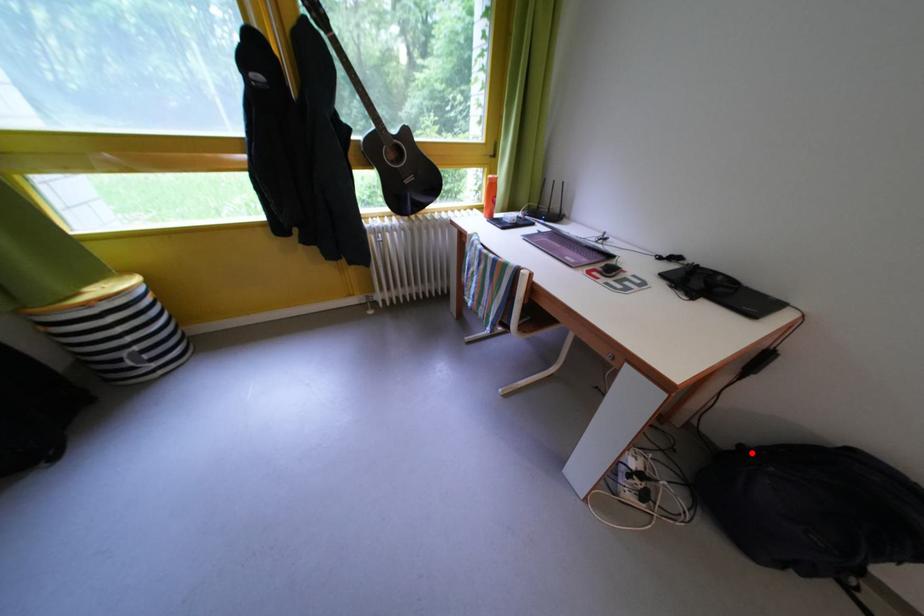
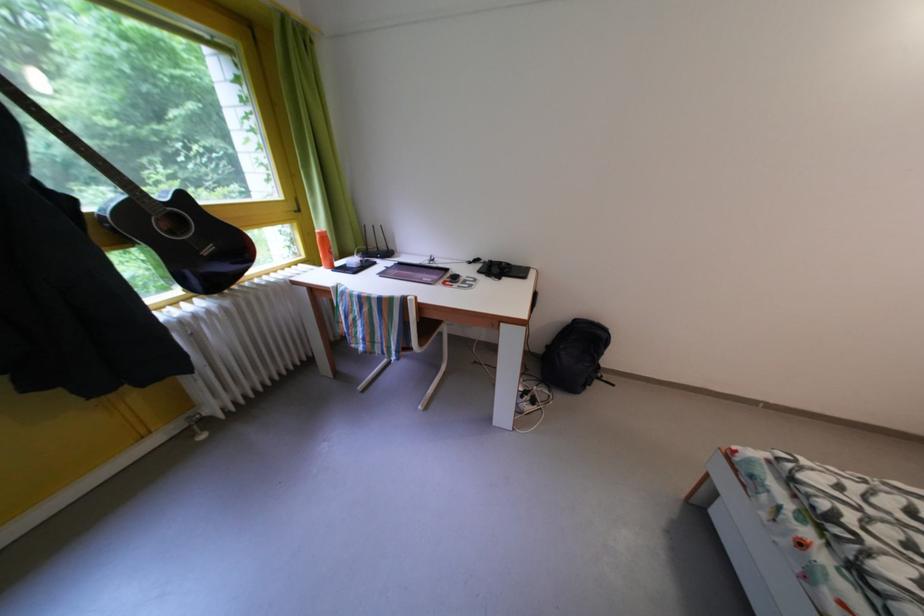
Find the pixel in the second image that matches the highlighted location in the first image.

(556, 353)